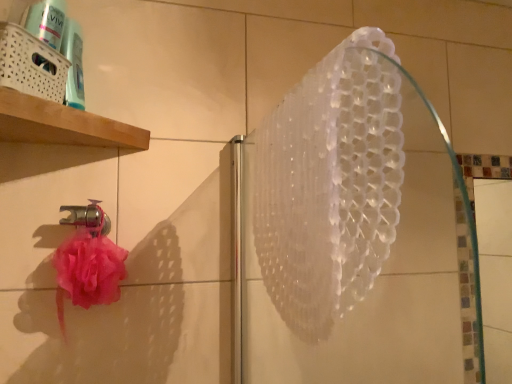
Question: Is transparent plastic shower at upper center wider or thinner than metallic silver faucet at lower left?

Choices:
 (A) thin
 (B) wide

Answer: (B)

Question: Is transparent plastic shower at upper center in front of or behind metallic silver faucet at lower left in the image?

Choices:
 (A) front
 (B) behind

Answer: (A)

Question: Estimate the real-world distances between objects in this image. Which object is closer to the metallic silver faucet at lower left?

Choices:
 (A) white woven basket at upper left
 (B) transparent plastic shower at upper center

Answer: (A)

Question: Which object is positioned farthest from the white woven basket at upper left?

Choices:
 (A) transparent plastic shower at upper center
 (B) metallic silver faucet at lower left

Answer: (A)